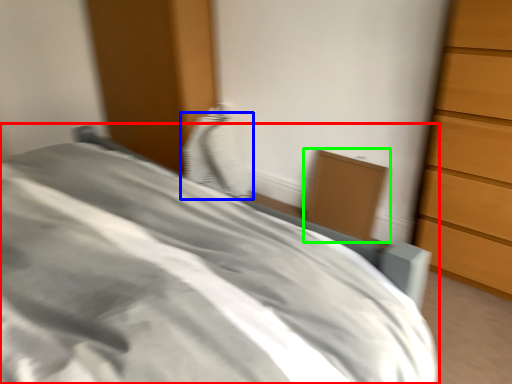
Question: Based on their relative distances, which object is nearer to bed (highlighted by a red box)? Choose from pillow (highlighted by a blue box) and cabinetry (highlighted by a green box).

Choices:
 (A) pillow
 (B) cabinetry

Answer: (B)